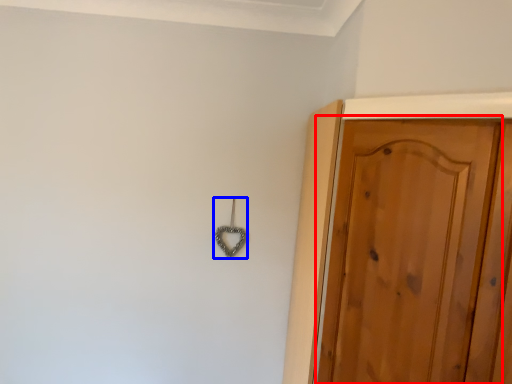
Question: Which object is closer to the camera taking this photo, door (highlighted by a red box) or hook (highlighted by a blue box)?

Choices:
 (A) door
 (B) hook

Answer: (A)